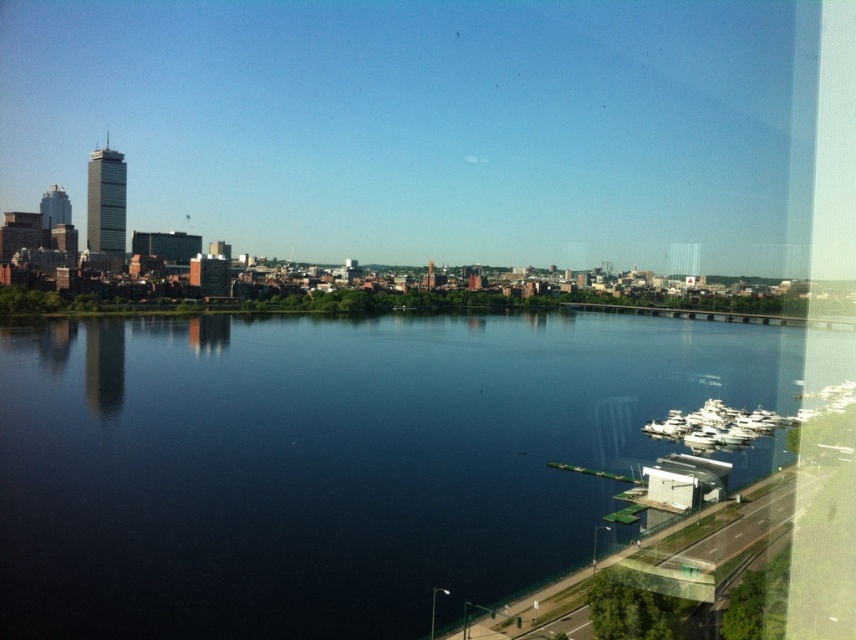
You are a photographer standing at the edge of the dark blue water at center, aiming to capture the white glossy boats at lower right in your shot. Based on their relative heights, will the boats appear larger or smaller in the photograph compared to their actual size?

The dark blue water at center has a greater height compared to white glossy boats at lower right. Since the water is higher, the boats will appear smaller in the photograph compared to their actual size.

You are a photographer planning to capture the entire scene in one shot. Given that your camera can only focus on objects within a 10m width, will the dark blue water at center and the white glossy boats at lower right both fit within the frame?

The dark blue water at center has a larger width than the white glossy boats at lower right. Since the camera can focus on objects within a 10m width, both objects can fit as long as their combined width does not exceed 10m. However, the description only states the water is wider than the boats, but not their exact widths. Without specific measurements, it is impossible to determine if both will fit within the 10m limit.